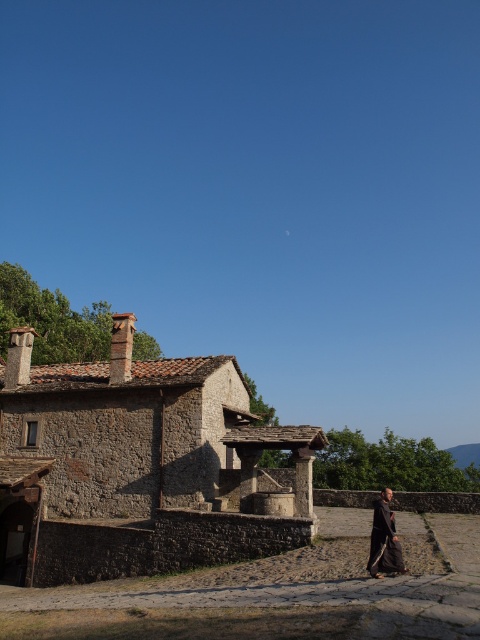
You are standing in the middle of the paved area in front of the rustic stone building. You need to determine which object, the rustic stone village at lower left or the dark brown woolen robe at lower right, is taller. Based on the scene, can you identify which one is taller?

The rustic stone village at lower left is much taller than the dark brown woolen robe at lower right.

You are a traveler who just arrived at the rustic stone village at lower left and want to find the dark brown woolen robe at lower right. Based on the scene, which object is bigger in size?

The rustic stone village at lower left is larger in size than the dark brown woolen robe at lower right, so the rustic stone village at lower left is bigger.